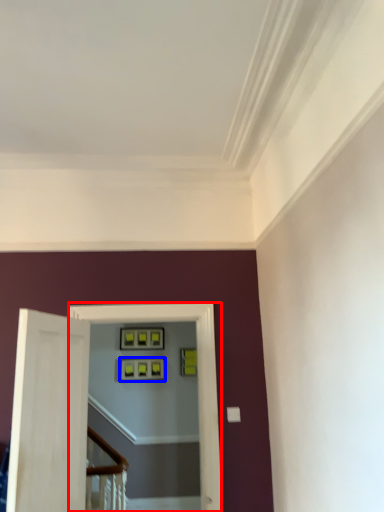
Question: Among these objects, which one is nearest to the camera, passage (highlighted by a red box) or picture frame (highlighted by a blue box)?

Choices:
 (A) passage
 (B) picture frame

Answer: (A)